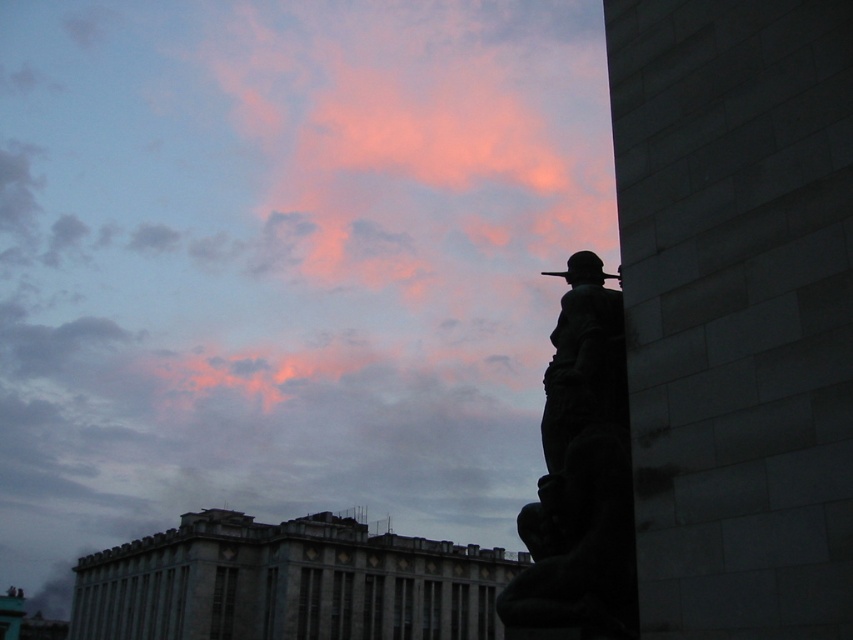
Which is above, pink cloud at upper center or gray stone building at center?

pink cloud at upper center is higher up.

The width and height of the screenshot is (853, 640). Describe the element at coordinates (283, 260) in the screenshot. I see `pink cloud at upper center` at that location.

The image size is (853, 640). I want to click on pink cloud at upper center, so click(283, 260).

From the picture: Can you confirm if white stone pillar at right is positioned below gray stone building at center?

No.

Which is in front, point (782, 605) or point (286, 536)?

Point (782, 605) is more forward.

Which is in front, point (756, 524) or point (463, 637)?

Point (756, 524) is in front.

What are the coordinates of `white stone pillar at right` in the screenshot? It's located at click(737, 308).

Does pink cloud at upper center lie behind white stone pillar at right?

Yes, pink cloud at upper center is further from the viewer.

This screenshot has height=640, width=853. I want to click on pink cloud at upper center, so click(x=283, y=260).

Locate an element on the screen. The image size is (853, 640). pink cloud at upper center is located at coordinates (283, 260).